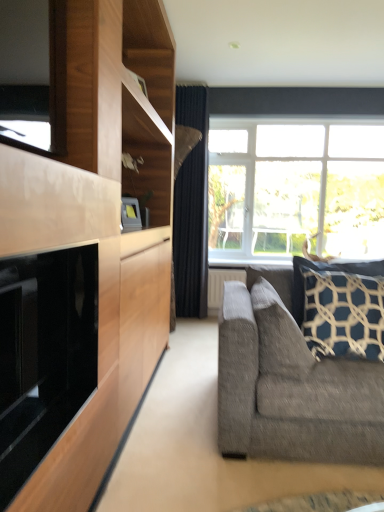
Question: Is clear glass window at upper center shorter than dark blue textured pillow at right, marked as the first pillow in a left-to-right arrangement?

Choices:
 (A) yes
 (B) no

Answer: (B)

Question: Does clear glass window at upper center come behind dark blue textured pillow at right, marked as the first pillow in a left-to-right arrangement?

Choices:
 (A) yes
 (B) no

Answer: (A)

Question: From the image's perspective, is clear glass window at upper center above dark blue textured pillow at right, marked as the first pillow in a left-to-right arrangement?

Choices:
 (A) yes
 (B) no

Answer: (A)

Question: Does clear glass window at upper center have a greater height compared to dark blue textured pillow at right, marked as the first pillow in a left-to-right arrangement?

Choices:
 (A) no
 (B) yes

Answer: (B)

Question: Is clear glass window at upper center looking in the opposite direction of dark blue textured pillow at right, which ranks as the second pillow in right-to-left order?

Choices:
 (A) yes
 (B) no

Answer: (B)

Question: Considering the positions of point (213, 199) and point (347, 269), is point (213, 199) closer or farther from the camera than point (347, 269)?

Choices:
 (A) closer
 (B) farther

Answer: (B)

Question: From a real-world perspective, relative to dark blue textured pillow at right, which is counted as the 1th pillow, starting from the right, is clear glass window at upper center vertically above or below?

Choices:
 (A) above
 (B) below

Answer: (A)

Question: Based on their sizes in the image, would you say clear glass window at upper center is bigger or smaller than dark blue textured pillow at right, which is counted as the 1th pillow, starting from the right?

Choices:
 (A) big
 (B) small

Answer: (A)

Question: Relative to dark blue textured pillow at right, which is counted as the 1th pillow, starting from the right, is clear glass window at upper center in front or behind?

Choices:
 (A) front
 (B) behind

Answer: (B)

Question: Considering their positions, is dark blue textured pillow at right, which ranks as the second pillow in right-to-left order, located in front of or behind dark blue textured pillow at right, which is counted as the 1th pillow, starting from the right?

Choices:
 (A) front
 (B) behind

Answer: (A)

Question: Considering the positions of point (291, 353) and point (326, 272), is point (291, 353) closer or farther from the camera than point (326, 272)?

Choices:
 (A) closer
 (B) farther

Answer: (A)

Question: From a real-world perspective, is dark blue textured pillow at right, marked as the first pillow in a left-to-right arrangement, above or below dark blue textured pillow at right, which is the second pillow in left-to-right order?

Choices:
 (A) above
 (B) below

Answer: (B)

Question: Considering the positions of dark blue textured pillow at right, which ranks as the second pillow in right-to-left order, and dark blue textured pillow at right, which is counted as the 1th pillow, starting from the right, in the image, is dark blue textured pillow at right, which ranks as the second pillow in right-to-left order, wider or thinner than dark blue textured pillow at right, which is counted as the 1th pillow, starting from the right,?

Choices:
 (A) thin
 (B) wide

Answer: (B)

Question: Is dark blue textured pillow at right, which is the second pillow in left-to-right order, in front of or behind dark blue textured pillow at right, marked as the first pillow in a left-to-right arrangement, in the image?

Choices:
 (A) front
 (B) behind

Answer: (B)

Question: Is point (370, 348) closer or farther from the camera than point (263, 293)?

Choices:
 (A) farther
 (B) closer

Answer: (A)